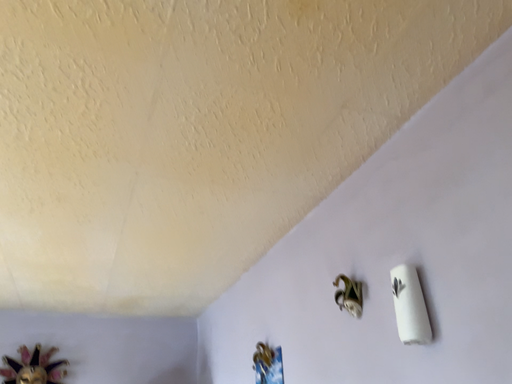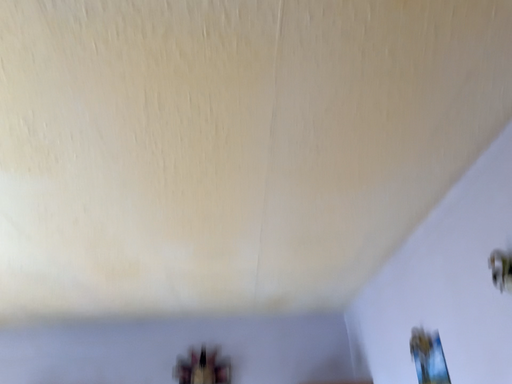
Question: Which way did the camera rotate in the video?

Choices:
 (A) rotated right
 (B) rotated left

Answer: (B)